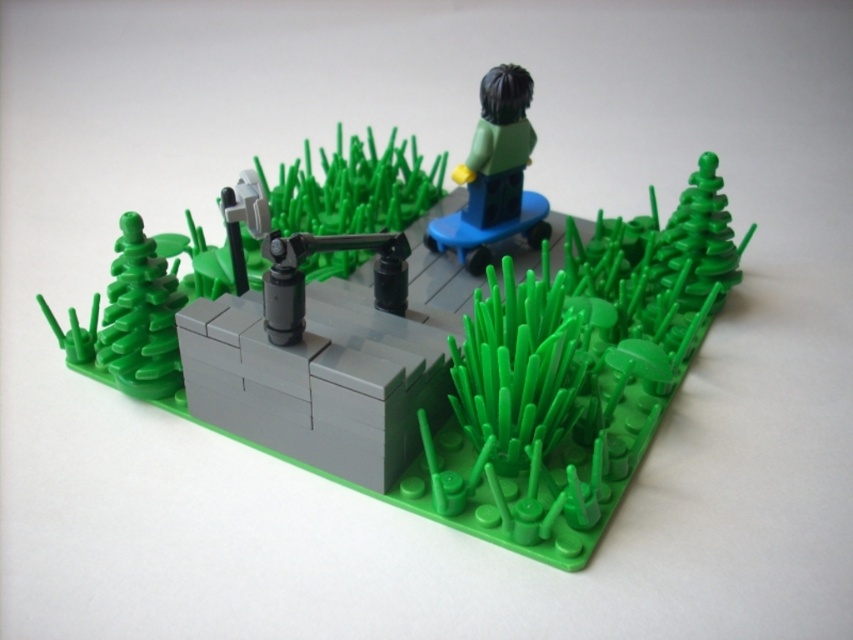
You are a LEGO figure standing at the edge of the grassy area in the miniature park scene. You see a point marked at coordinates (421,365). What object is located at that point?

The point at coordinates (421,365) indicates a smooth gray platform at center, which is likely the bridge or pathway structure mentioned in the scene description.

Consider the image. You are a tiny LEGO figure standing at the edge of the LEGO grass field. You see the smooth gray platform at center. In which direction should you walk to reach it?

The smooth gray platform at center is located at coordinates point (421, 365), so you should walk towards the center of the scene to reach it.